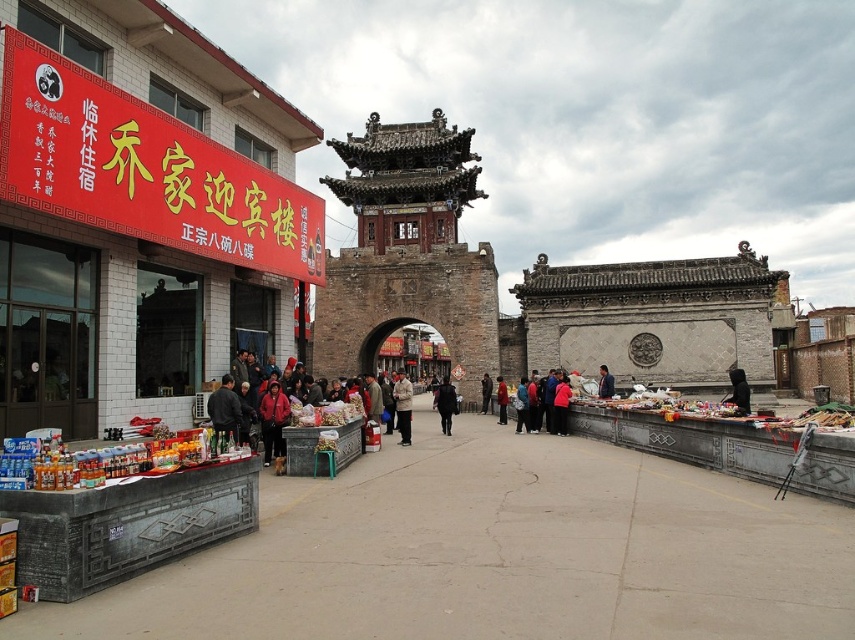
Who is positioned more to the left, red matte signboard at upper left or dark blue suit at center?

red matte signboard at upper left

Between red matte signboard at upper left and dark blue suit at center, which one has more height?

red matte signboard at upper left

Measure the distance between red matte signboard at upper left and camera.

red matte signboard at upper left and camera are 46.33 meters apart.

Identify the location of red matte signboard at upper left. This screenshot has width=855, height=640. (139, 214).

Between black matte jacket at center and dark gray wool coat at center, which one is positioned lower?

Positioned lower is dark gray wool coat at center.

What do you see at coordinates (738, 390) in the screenshot? The height and width of the screenshot is (640, 855). I see `black matte jacket at center` at bounding box center [738, 390].

Which is behind, point (736, 404) or point (487, 387)?

The point (487, 387) is behind.

Find the location of a particular element. The width and height of the screenshot is (855, 640). black matte jacket at center is located at coordinates (738, 390).

Does dark gray jacket at center appear on the right side of white matte jacket at center?

No, dark gray jacket at center is not to the right of white matte jacket at center.

Can you confirm if dark gray jacket at center is positioned below white matte jacket at center?

No, dark gray jacket at center is not below white matte jacket at center.

Between point (233, 419) and point (399, 380), which one is positioned in front?

Point (233, 419) is more forward.

Locate an element on the screen. The height and width of the screenshot is (640, 855). dark gray jacket at center is located at coordinates (223, 408).